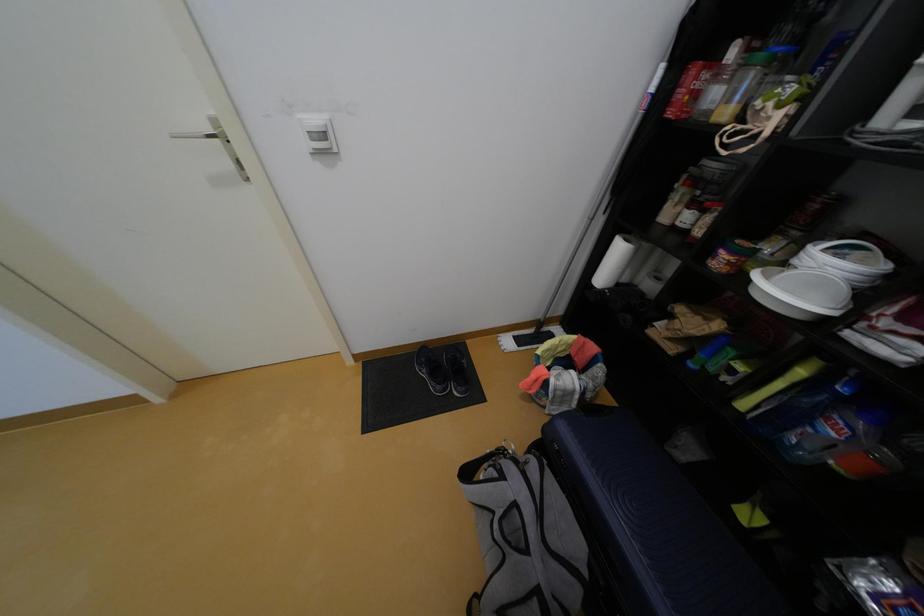
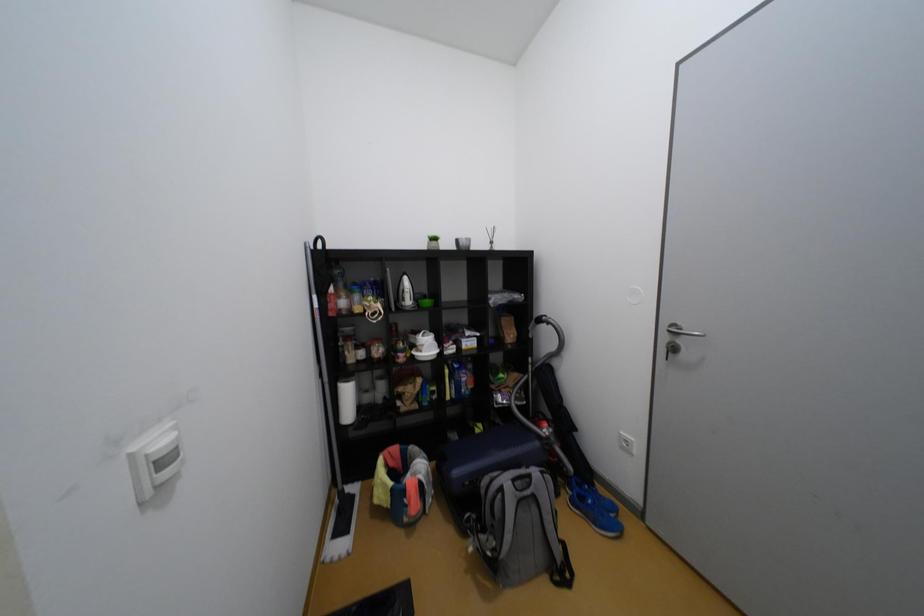
Question: The camera is either moving clockwise (left) or counter-clockwise (right) around the object. The first image is from the beginning of the video and the second image is from the end. Is the camera moving left or right when shooting the video?

Choices:
 (A) Left
 (B) Right

Answer: (A)